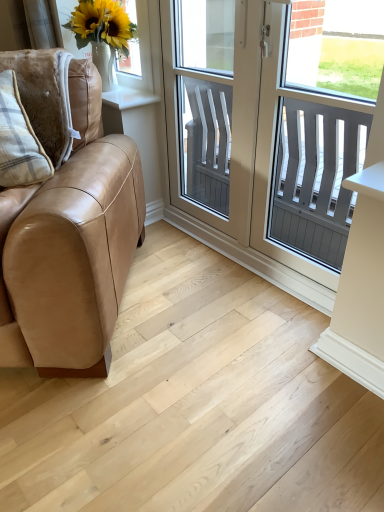
You are a GUI agent. You are given a task and a screenshot of the screen. Output one action in this format:
    pyautogui.click(x=<x>, y=<y>)
    Task: Click on the vacant region above light wood floor at lower left (from a real-world perspective)
    
    Given the screenshot: What is the action you would take?
    pyautogui.click(x=178, y=358)